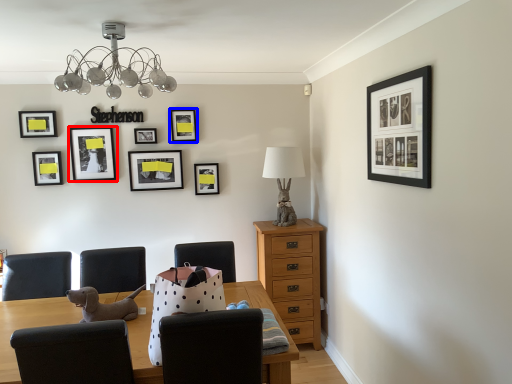
Question: Which object is closer to the camera taking this photo, picture frame (highlighted by a red box) or picture frame (highlighted by a blue box)?

Choices:
 (A) picture frame
 (B) picture frame

Answer: (A)